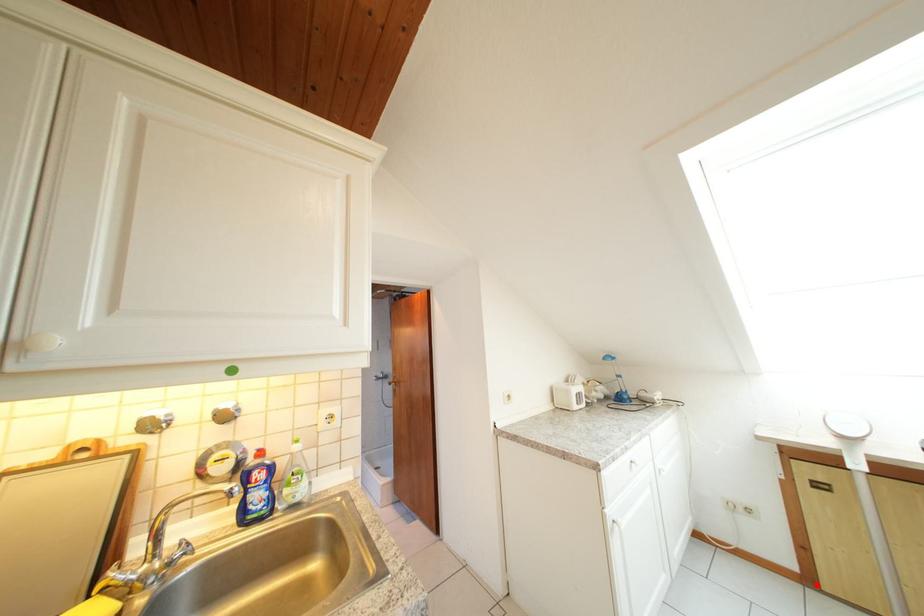
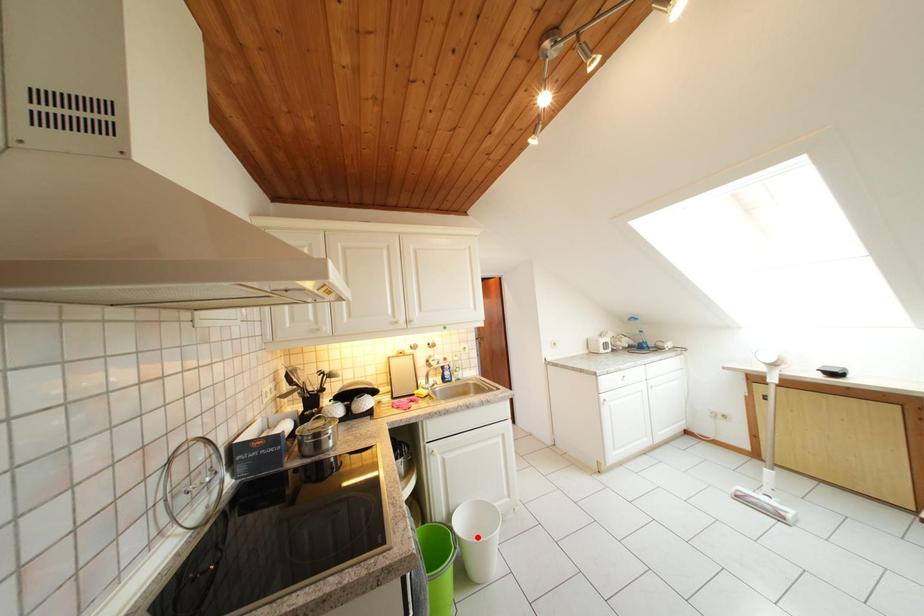
I am providing you with two images of the same scene from different viewpoints. A red point is marked on the first image and another point is marked on the second image. Is the red point in image1 aligned with the point shown in image2?

No